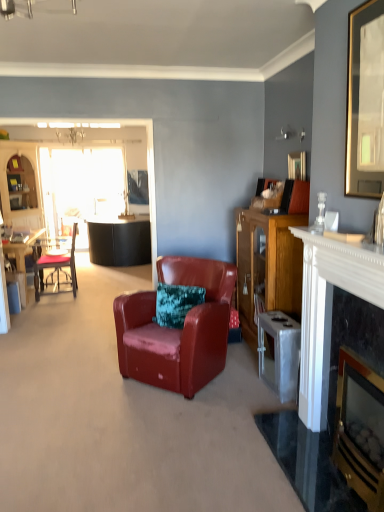
Question: Based on their sizes in the image, would you say metallic silver trash can at right is bigger or smaller than wooden cabinet at left, which is the 2th entertainment center in front-to-back order?

Choices:
 (A) big
 (B) small

Answer: (B)

Question: Is metallic silver trash can at right taller or shorter than wooden cabinet at left, which is the 2th entertainment center in front-to-back order?

Choices:
 (A) short
 (B) tall

Answer: (A)

Question: Which of these objects is positioned farthest from the wooden cabinet at right?

Choices:
 (A) wooden cabinet at left, which ranks as the 1th entertainment center in back-to-front order
 (B) transparent glass door at left
 (C) black marble fireplace at right, which is counted as the 2th fireplace, starting from the left
 (D) leather armchair at center, the first chair viewed from the front
 (E) gold-framed picture at upper right, which ranks as the 2th picture frame in back-to-front order

Answer: (B)

Question: Considering the real-world distances, which object is farthest from the gold-framed picture at upper right, arranged as the first picture frame when viewed from the front?

Choices:
 (A) metallic silver trash can at right
 (B) matte black chair at left, the second chair from the right
 (C) gold-framed picture at upper right, the 2th picture frame when ordered from front to back
 (D) wooden cabinet at left, the first entertainment center in the left-to-right sequence
 (E) black leather sofa at left, placed as the 1th entertainment center when sorted from front to back

Answer: (E)